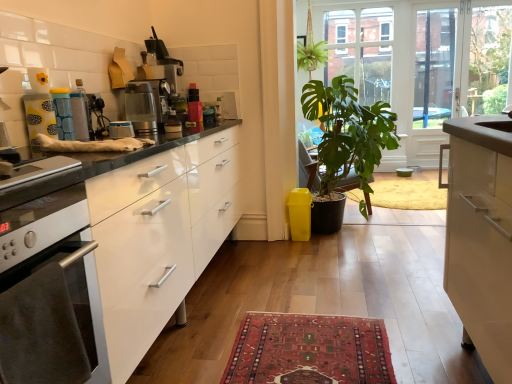
Question: Can you confirm if yellow plastic trash bin/can at lower right is taller than clear glass screen door at upper right?

Choices:
 (A) no
 (B) yes

Answer: (A)

Question: Could you tell me if yellow plastic trash bin/can at lower right is turned towards clear glass screen door at upper right?

Choices:
 (A) no
 (B) yes

Answer: (A)

Question: Is yellow plastic trash bin/can at lower right shorter than clear glass screen door at upper right?

Choices:
 (A) no
 (B) yes

Answer: (B)

Question: Considering the relative positions of yellow plastic trash bin/can at lower right and clear glass screen door at upper right in the image provided, is yellow plastic trash bin/can at lower right in front of clear glass screen door at upper right?

Choices:
 (A) yes
 (B) no

Answer: (A)

Question: From the image's perspective, is yellow plastic trash bin/can at lower right located beneath clear glass screen door at upper right?

Choices:
 (A) yes
 (B) no

Answer: (A)

Question: Is yellow plastic trash bin/can at lower right next to clear glass screen door at upper right?

Choices:
 (A) no
 (B) yes

Answer: (A)

Question: Considering the relative positions of matte blue canister at center, acting as the 2th appliance starting from the right, and matte yellow container at upper left, arranged as the third appliance when viewed from the right, in the image provided, is matte blue canister at center, acting as the 2th appliance starting from the right, to the right of matte yellow container at upper left, arranged as the third appliance when viewed from the right, from the viewer's perspective?

Choices:
 (A) yes
 (B) no

Answer: (A)

Question: Is matte blue canister at center, acting as the 2th appliance starting from the right, outside matte yellow container at upper left, arranged as the third appliance when viewed from the right?

Choices:
 (A) yes
 (B) no

Answer: (A)

Question: From the image's perspective, is matte blue canister at center, which is counted as the second appliance, starting from the left, under matte yellow container at upper left, arranged as the 1th appliance when viewed from the left?

Choices:
 (A) no
 (B) yes

Answer: (A)

Question: Could you tell me if matte blue canister at center, which is counted as the second appliance, starting from the left, is facing matte yellow container at upper left, arranged as the third appliance when viewed from the right?

Choices:
 (A) yes
 (B) no

Answer: (B)

Question: Does matte blue canister at center, which is counted as the second appliance, starting from the left, have a smaller size compared to matte yellow container at upper left, arranged as the 1th appliance when viewed from the left?

Choices:
 (A) yes
 (B) no

Answer: (B)

Question: Does matte blue canister at center, acting as the 2th appliance starting from the right, have a lesser height compared to matte yellow container at upper left, arranged as the 1th appliance when viewed from the left?

Choices:
 (A) no
 (B) yes

Answer: (A)

Question: Considering the relative positions of brushed metal toaster at center, which is counted as the 1th appliance, starting from the right, and transparent glass door at upper center in the image provided, is brushed metal toaster at center, which is counted as the 1th appliance, starting from the right, behind transparent glass door at upper center?

Choices:
 (A) no
 (B) yes

Answer: (A)